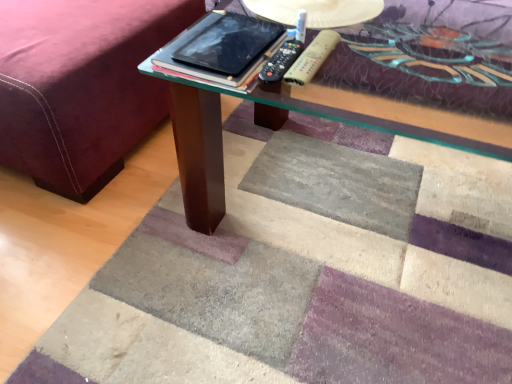
What are the coordinates of `vacant area to the right of velvet maroon bed frame at lower left` in the screenshot? It's located at (278, 168).